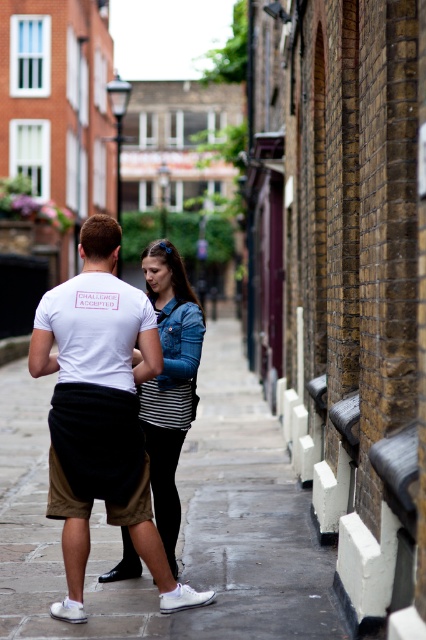
You are standing at the edge of the street and want to walk to the denim jacket at center without stepping on the smooth concrete pavement at center. Is this possible?

The smooth concrete pavement at center and denim jacket at center are 6.38 meters apart from each other. Since you can walk around the smooth concrete pavement at center, it is possible to reach the denim jacket at center without stepping on it.

Looking at this image, you are a photographer trying to capture a photo of both individuals in the scene. You notice two points marked in the image. The first point is at coordinates point (114, 529) and the second at point (196, 362). Based on their positions, which point should you focus on to ensure both people are in frame?

Point (114, 529) is behind point (196, 362), so focusing on point (196, 362) will ensure both individuals are in frame.